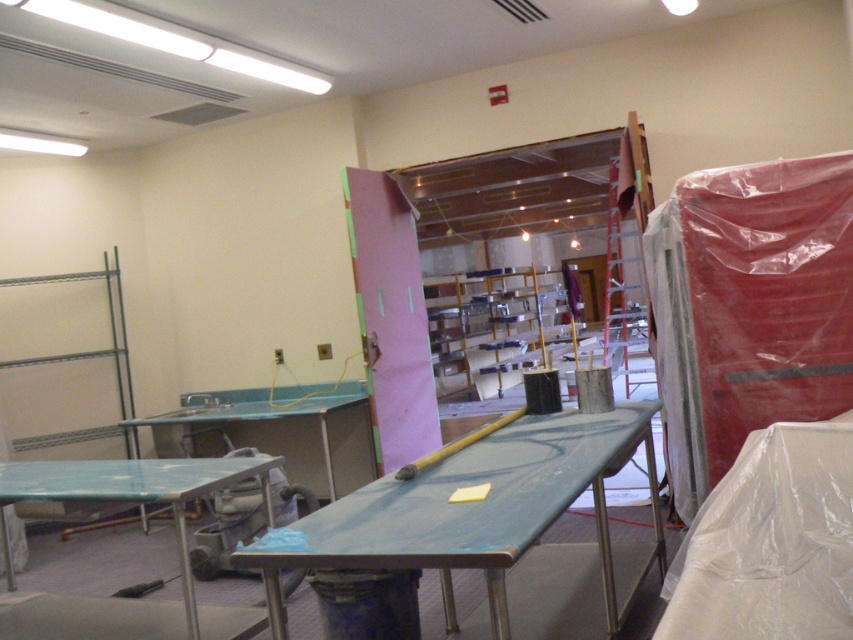
Question: From the image, what is the correct spatial relationship of blue laminate table at lower left in relation to metallic blue table at center?

Choices:
 (A) left
 (B) right

Answer: (A)

Question: Can you confirm if green matte table at center is thinner than metallic blue table at center?

Choices:
 (A) no
 (B) yes

Answer: (B)

Question: Which object is positioned farthest from the blue laminate table at lower left?

Choices:
 (A) metallic blue table at center
 (B) green matte table at center

Answer: (A)

Question: Can you confirm if blue laminate table at lower left is wider than metallic blue table at center?

Choices:
 (A) yes
 (B) no

Answer: (B)

Question: Which of the following is the farthest from the observer?

Choices:
 (A) blue laminate table at lower left
 (B) metallic blue table at center
 (C) green matte table at center

Answer: (B)

Question: Which is nearer to the metallic blue table at center?

Choices:
 (A) green matte table at center
 (B) blue laminate table at lower left

Answer: (B)